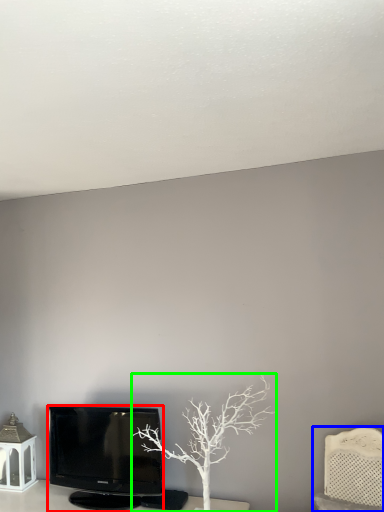
Question: Based on their relative distances, which object is nearer to television (highlighted by a red box)? Choose from furniture (highlighted by a blue box) and tree (highlighted by a green box).

Choices:
 (A) furniture
 (B) tree

Answer: (B)